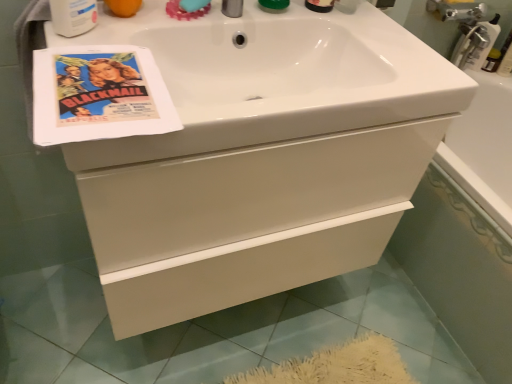
At what (x,y) coordinates should I click in order to perform the action: click on vacant space to the right of white plastic mouthwash at upper left. Please return your answer as a coordinate pair (x, y). The height and width of the screenshot is (384, 512). Looking at the image, I should click on (132, 43).